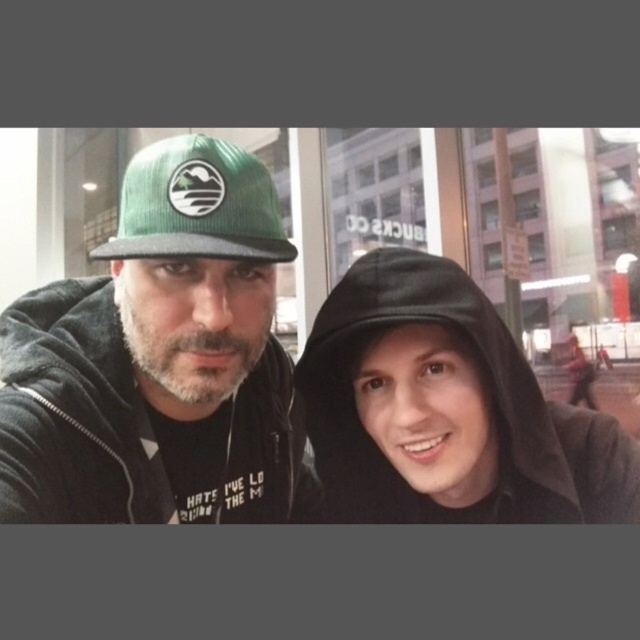
You are taking a selfie with two people in an urban setting. You want to ensure that the point at coordinates point [237,170] is in focus. What is the minimum distance you should set your camera to focus at?

The minimum distance you should set your camera to focus at is 25.26 inches because the point [237,170] is located at that distance from the camera.